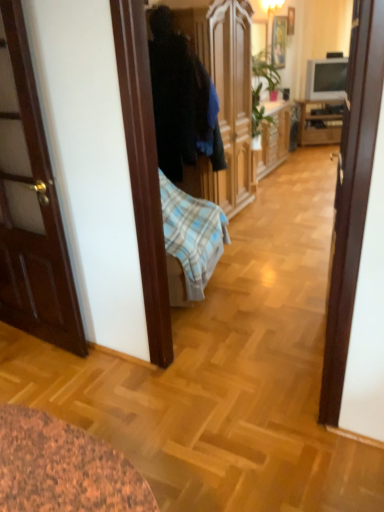
Question: From the image's perspective, is wooden picture frame at upper center, the 2th picture frame from the left, under wooden picture frame at upper center, the 1th picture frame viewed from the left?

Choices:
 (A) yes
 (B) no

Answer: (B)

Question: Considering the relative sizes of wooden picture frame at upper center, which is counted as the 1th picture frame, starting from the right, and wooden picture frame at upper center, which ranks as the second picture frame in right-to-left order, in the image provided, is wooden picture frame at upper center, which is counted as the 1th picture frame, starting from the right, thinner than wooden picture frame at upper center, which ranks as the second picture frame in right-to-left order,?

Choices:
 (A) no
 (B) yes

Answer: (B)

Question: Is wooden picture frame at upper center, the 2th picture frame from the left, surrounding wooden picture frame at upper center, the 1th picture frame viewed from the left?

Choices:
 (A) no
 (B) yes

Answer: (A)

Question: Considering the relative sizes of wooden picture frame at upper center, the 2th picture frame from the left, and wooden picture frame at upper center, the 1th picture frame viewed from the left, in the image provided, is wooden picture frame at upper center, the 2th picture frame from the left, smaller than wooden picture frame at upper center, the 1th picture frame viewed from the left,?

Choices:
 (A) no
 (B) yes

Answer: (B)

Question: Can you confirm if wooden picture frame at upper center, the 2th picture frame from the left, is positioned to the right of wooden picture frame at upper center, the 1th picture frame viewed from the left?

Choices:
 (A) no
 (B) yes

Answer: (B)

Question: Is wooden picture frame at upper center, which is counted as the 1th picture frame, starting from the right, taller or shorter than wooden cabinet at right?

Choices:
 (A) short
 (B) tall

Answer: (A)

Question: Is wooden picture frame at upper center, the 2th picture frame from the left, wider or thinner than wooden cabinet at right?

Choices:
 (A) wide
 (B) thin

Answer: (B)

Question: Is wooden picture frame at upper center, the 2th picture frame from the left, bigger or smaller than wooden cabinet at right?

Choices:
 (A) small
 (B) big

Answer: (A)

Question: In the image, is wooden picture frame at upper center, which is counted as the 1th picture frame, starting from the right, positioned in front of or behind wooden cabinet at right?

Choices:
 (A) behind
 (B) front

Answer: (B)

Question: Do you think wooden picture frame at upper center, which is counted as the 1th picture frame, starting from the right, is within matte gray tv at upper right, or outside of it?

Choices:
 (A) outside
 (B) inside

Answer: (A)

Question: Considering the positions of wooden picture frame at upper center, the 2th picture frame from the left, and matte gray tv at upper right in the image, is wooden picture frame at upper center, the 2th picture frame from the left, wider or thinner than matte gray tv at upper right?

Choices:
 (A) thin
 (B) wide

Answer: (A)

Question: Based on their positions, is wooden picture frame at upper center, which is counted as the 1th picture frame, starting from the right, located to the left or right of matte gray tv at upper right?

Choices:
 (A) left
 (B) right

Answer: (A)

Question: Considering the positions of wooden picture frame at upper center, the 2th picture frame from the left, and matte gray tv at upper right in the image, is wooden picture frame at upper center, the 2th picture frame from the left, bigger or smaller than matte gray tv at upper right?

Choices:
 (A) small
 (B) big

Answer: (A)

Question: Considering their positions, is wooden picture frame at upper center, the 1th picture frame viewed from the left, located in front of or behind matte gray tv at upper right?

Choices:
 (A) behind
 (B) front

Answer: (B)

Question: Visually, is wooden picture frame at upper center, the 1th picture frame viewed from the left, positioned to the left or to the right of matte gray tv at upper right?

Choices:
 (A) right
 (B) left

Answer: (B)